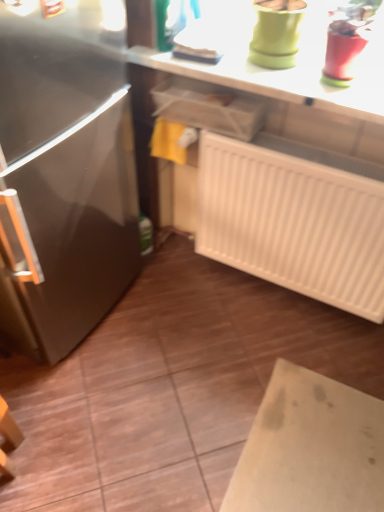
What is the approximate height of smooth white countertop at upper center?

The height of smooth white countertop at upper center is 1.56 inches.

I want to click on smooth white countertop at upper center, so click(x=285, y=69).

Describe the element at coordinates (285, 69) in the screenshot. I see `smooth white countertop at upper center` at that location.

Image resolution: width=384 pixels, height=512 pixels. I want to click on white plastic radiator at lower right, so click(x=292, y=221).

Image resolution: width=384 pixels, height=512 pixels. What do you see at coordinates (292, 221) in the screenshot?
I see `white plastic radiator at lower right` at bounding box center [292, 221].

Where is `smooth white countertop at upper center`? smooth white countertop at upper center is located at coordinates (285, 69).

Can you confirm if smooth white countertop at upper center is positioned to the left of white plastic radiator at lower right?

Yes, smooth white countertop at upper center is to the left of white plastic radiator at lower right.

Which object is further away from the camera, smooth white countertop at upper center or white plastic radiator at lower right?

white plastic radiator at lower right is behind.

Is point (341, 105) less distant than point (212, 232)?

Yes, it is.

From the image's perspective, relative to white plastic radiator at lower right, is smooth white countertop at upper center above or below?

smooth white countertop at upper center is situated higher than white plastic radiator at lower right in the image.

From a real-world perspective, who is located higher, smooth white countertop at upper center or white plastic radiator at lower right?

In real-world perspective, smooth white countertop at upper center is above.

Looking at their sizes, would you say smooth white countertop at upper center is wider or thinner than white plastic radiator at lower right?

smooth white countertop at upper center is wider than white plastic radiator at lower right.

Who is taller, smooth white countertop at upper center or white plastic radiator at lower right?

white plastic radiator at lower right is taller.

Looking at the image, does smooth white countertop at upper center seem bigger or smaller compared to white plastic radiator at lower right?

Clearly, smooth white countertop at upper center is smaller in size than white plastic radiator at lower right.

Looking at this image, is smooth white countertop at upper center spatially inside white plastic radiator at lower right, or outside of it?

smooth white countertop at upper center cannot be found inside white plastic radiator at lower right.

Are smooth white countertop at upper center and white plastic radiator at lower right far apart?

Actually, smooth white countertop at upper center and white plastic radiator at lower right are a little close together.

Could you tell me if smooth white countertop at upper center is facing white plastic radiator at lower right?

No.

What are the coordinates of `countertop on the left of white plastic radiator at lower right` in the screenshot? It's located at (285, 69).

Visually, is white plastic radiator at lower right positioned to the left or to the right of smooth white countertop at upper center?

Clearly, white plastic radiator at lower right is on the right of smooth white countertop at upper center in the image.

Between white plastic radiator at lower right and smooth white countertop at upper center, which one is positioned behind?

white plastic radiator at lower right is further from the camera.

Considering the points (284, 237) and (310, 99), which point is in front, point (284, 237) or point (310, 99)?

Point (310, 99)

From the image's perspective, which object appears higher, white plastic radiator at lower right or smooth white countertop at upper center?

smooth white countertop at upper center, from the image's perspective.

From a real-world perspective, which is physically below, white plastic radiator at lower right or smooth white countertop at upper center?

white plastic radiator at lower right.

In terms of width, does white plastic radiator at lower right look wider or thinner when compared to smooth white countertop at upper center?

white plastic radiator at lower right is thinner than smooth white countertop at upper center.

Is white plastic radiator at lower right shorter than smooth white countertop at upper center?

In fact, white plastic radiator at lower right may be taller than smooth white countertop at upper center.

In the scene shown: Who is bigger, white plastic radiator at lower right or smooth white countertop at upper center?

white plastic radiator at lower right.

Is white plastic radiator at lower right not within smooth white countertop at upper center?

Yes.

Is white plastic radiator at lower right far from smooth white countertop at upper center?

No, there isn't a large distance between white plastic radiator at lower right and smooth white countertop at upper center.

From the picture: Is white plastic radiator at lower right oriented towards smooth white countertop at upper center?

No, white plastic radiator at lower right does not turn towards smooth white countertop at upper center.

Can you tell me how much white plastic radiator at lower right and smooth white countertop at upper center differ in facing direction?

The angle between the facing direction of white plastic radiator at lower right and the facing direction of smooth white countertop at upper center is 1.01 degrees.

How distant is white plastic radiator at lower right from smooth white countertop at upper center?

white plastic radiator at lower right is 38.06 centimeters away from smooth white countertop at upper center.

There is a white plastic radiator at lower right. At what (x,y) coordinates should I click in order to perform the action: click on countertop above it (from a real-world perspective). Please return your answer as a coordinate pair (x, y). The width and height of the screenshot is (384, 512). Looking at the image, I should click on (285, 69).

Where is `countertop to the left of white plastic radiator at lower right`? Image resolution: width=384 pixels, height=512 pixels. countertop to the left of white plastic radiator at lower right is located at coordinates (285, 69).

Locate an element on the screen. Image resolution: width=384 pixels, height=512 pixels. radiator below the smooth white countertop at upper center (from the image's perspective) is located at coordinates (292, 221).